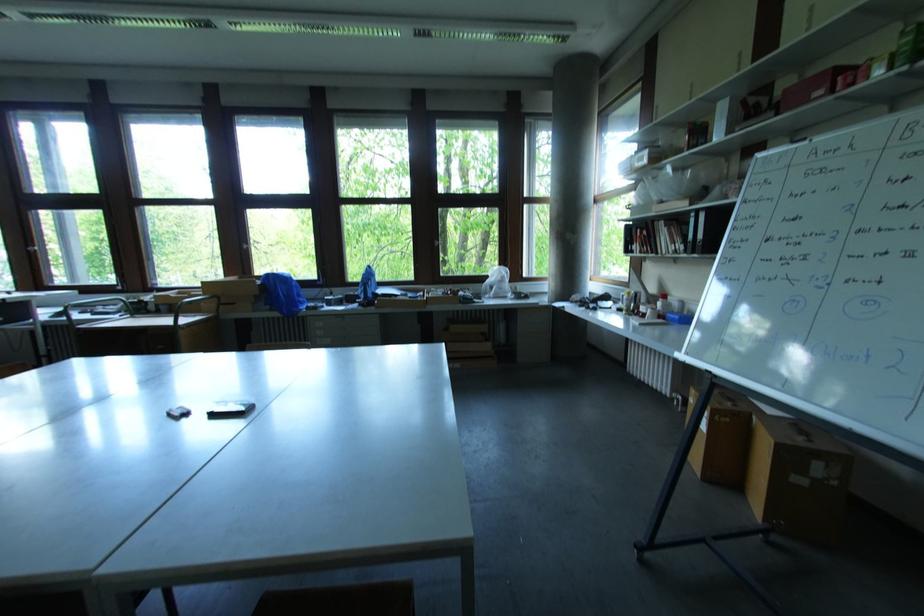
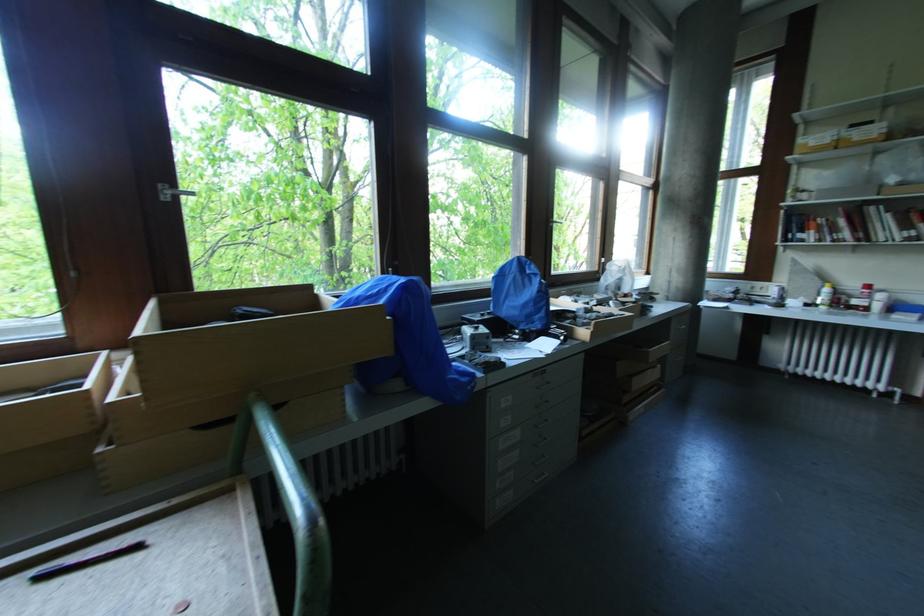
The point at (667, 298) is marked in the first image. Where is the corresponding point in the second image?

(871, 288)